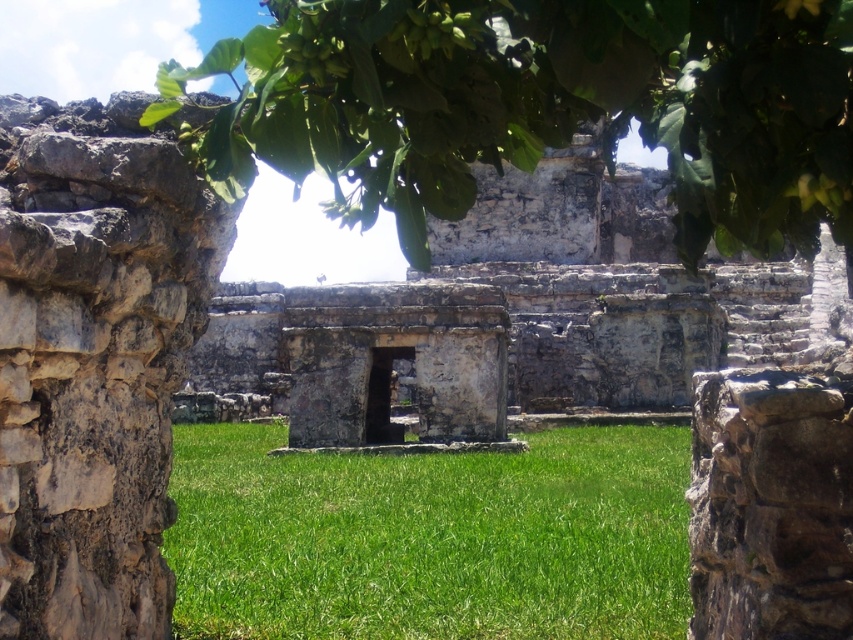
Which of these two, green leafy tree at upper center or green grass at center, stands taller?

green leafy tree at upper center is taller.

Consider the image. Can you confirm if green leafy tree at upper center is thinner than green grass at center?

Correct, green leafy tree at upper center's width is less than green grass at center's.

Find the location of `green leafy tree at upper center`. green leafy tree at upper center is located at coordinates (541, 106).